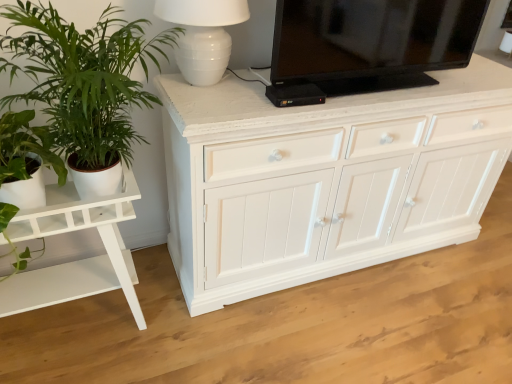
Question: Is black glossy television at upper center to the left or to the right of green leafy plant at left in the image?

Choices:
 (A) left
 (B) right

Answer: (B)

Question: From a real-world perspective, is black glossy television at upper center physically located above or below green leafy plant at left?

Choices:
 (A) below
 (B) above

Answer: (B)

Question: Considering the real-world distances, which object is closest to the black glossy television at upper center?

Choices:
 (A) white glossy table at left
 (B) green leafy plant at left
 (C) white ceramic lamp at upper center

Answer: (C)

Question: Based on their relative distances, which object is nearer to the green leafy plant at left?

Choices:
 (A) white ceramic lamp at upper center
 (B) black glossy television at upper center
 (C) white glossy table at left

Answer: (A)